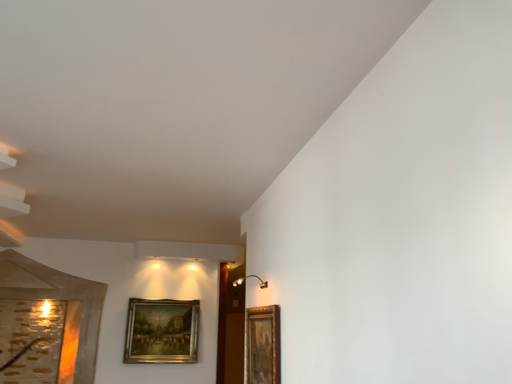
You are a GUI agent. You are given a task and a screenshot of the screen. Output one action in this format:
    pyautogui.click(x=<x>, y=<y>)
    Task: Click on the gold-framed painting at center-left, the first picture frame viewed from the back
    This screenshot has width=512, height=384.
    Given the screenshot: What is the action you would take?
    pyautogui.click(x=161, y=331)

Describe the element at coordinates (161, 331) in the screenshot. The height and width of the screenshot is (384, 512). I see `gold-framed painting at center-left, the first picture frame positioned from the bottom` at that location.

This screenshot has height=384, width=512. I want to click on gold-toned wooden picture frame at right, positioned as the 1th picture frame in top-to-bottom order, so click(263, 345).

This screenshot has height=384, width=512. Describe the element at coordinates (263, 345) in the screenshot. I see `gold-toned wooden picture frame at right, positioned as the 1th picture frame in top-to-bottom order` at that location.

The image size is (512, 384). I want to click on gold-framed painting at center-left, the first picture frame viewed from the back, so click(x=161, y=331).

In the image, is gold-toned wooden picture frame at right, the second picture frame when ordered from back to front, on the left side or the right side of gold-framed painting at center-left, acting as the 1th picture frame starting from the left?

gold-toned wooden picture frame at right, the second picture frame when ordered from back to front, is to the right of gold-framed painting at center-left, acting as the 1th picture frame starting from the left.

Is gold-toned wooden picture frame at right, positioned as the 1th picture frame in front-to-back order, in front of or behind gold-framed painting at center-left, the first picture frame positioned from the bottom, in the image?

Visually, gold-toned wooden picture frame at right, positioned as the 1th picture frame in front-to-back order, is located in front of gold-framed painting at center-left, the first picture frame positioned from the bottom.

Does point (255, 369) come behind point (192, 325)?

No.

From the image's perspective, which one is positioned higher, gold-toned wooden picture frame at right, which is counted as the 2th picture frame, starting from the left, or gold-framed painting at center-left, the first picture frame positioned from the bottom?

From the image's view, gold-toned wooden picture frame at right, which is counted as the 2th picture frame, starting from the left, is above.

From a real-world perspective, between gold-toned wooden picture frame at right, positioned as the 1th picture frame in front-to-back order, and gold-framed painting at center-left, the first picture frame positioned from the bottom, who is vertically lower?

gold-toned wooden picture frame at right, positioned as the 1th picture frame in front-to-back order.

Does gold-toned wooden picture frame at right, which is the 1th picture frame from right to left, have a greater width compared to gold-framed painting at center-left, acting as the 1th picture frame starting from the left?

No, gold-toned wooden picture frame at right, which is the 1th picture frame from right to left, is not wider than gold-framed painting at center-left, acting as the 1th picture frame starting from the left.

Which of these two, gold-toned wooden picture frame at right, positioned as the 1th picture frame in top-to-bottom order, or gold-framed painting at center-left, acting as the 1th picture frame starting from the left, stands taller?

gold-framed painting at center-left, acting as the 1th picture frame starting from the left.

Can you confirm if gold-toned wooden picture frame at right, positioned as the 1th picture frame in top-to-bottom order, is smaller than gold-framed painting at center-left, the 2th picture frame viewed from the right?

Correct, gold-toned wooden picture frame at right, positioned as the 1th picture frame in top-to-bottom order, occupies less space than gold-framed painting at center-left, the 2th picture frame viewed from the right.

Is gold-framed painting at center-left, the 2th picture frame viewed from the right, surrounded by gold-toned wooden picture frame at right, positioned as the 1th picture frame in top-to-bottom order?

Actually, gold-framed painting at center-left, the 2th picture frame viewed from the right, is outside gold-toned wooden picture frame at right, positioned as the 1th picture frame in top-to-bottom order.

Is gold-toned wooden picture frame at right, arranged as the 2th picture frame when ordered from the bottom, not near gold-framed painting at center-left, the first picture frame viewed from the back?

Yes, gold-toned wooden picture frame at right, arranged as the 2th picture frame when ordered from the bottom, is far from gold-framed painting at center-left, the first picture frame viewed from the back.

Could you tell me if gold-toned wooden picture frame at right, which is the 1th picture frame from right to left, is turned towards gold-framed painting at center-left, the first picture frame positioned from the bottom?

No.

What's the angular difference between gold-toned wooden picture frame at right, arranged as the 2th picture frame when ordered from the bottom, and gold-framed painting at center-left, the 2th picture frame viewed from the right,'s facing directions?

The angle between the facing direction of gold-toned wooden picture frame at right, arranged as the 2th picture frame when ordered from the bottom, and the facing direction of gold-framed painting at center-left, the 2th picture frame viewed from the right, is 88.3 degrees.

The height and width of the screenshot is (384, 512). In the image, there is a gold-framed painting at center-left, the 2th picture frame positioned from the top. What are the coordinates of `picture frame above it (from the image's perspective)` in the screenshot? It's located at (263, 345).

Which is more to the right, gold-framed painting at center-left, the 2th picture frame viewed from the right, or gold-toned wooden picture frame at right, positioned as the 1th picture frame in top-to-bottom order?

Positioned to the right is gold-toned wooden picture frame at right, positioned as the 1th picture frame in top-to-bottom order.

Considering the positions of objects gold-framed painting at center-left, the 2th picture frame viewed from the right, and gold-toned wooden picture frame at right, the second picture frame when ordered from back to front, in the image provided, who is in front, gold-framed painting at center-left, the 2th picture frame viewed from the right, or gold-toned wooden picture frame at right, the second picture frame when ordered from back to front,?

gold-toned wooden picture frame at right, the second picture frame when ordered from back to front.

Considering the positions of points (157, 359) and (277, 341), is point (157, 359) farther from camera compared to point (277, 341)?

Yes, it is behind point (277, 341).

From the image's perspective, is gold-framed painting at center-left, the 2th picture frame viewed from the right, under gold-toned wooden picture frame at right, arranged as the 2th picture frame when ordered from the bottom?

Yes, from the image's perspective, gold-framed painting at center-left, the 2th picture frame viewed from the right, is beneath gold-toned wooden picture frame at right, arranged as the 2th picture frame when ordered from the bottom.

From a real-world perspective, between gold-framed painting at center-left, acting as the 1th picture frame starting from the left, and gold-toned wooden picture frame at right, which is the 1th picture frame from right to left, who is vertically lower?

In real-world perspective, gold-toned wooden picture frame at right, which is the 1th picture frame from right to left, is lower.

Is gold-framed painting at center-left, the 2th picture frame viewed from the right, wider or thinner than gold-toned wooden picture frame at right, which is counted as the 2th picture frame, starting from the left?

Considering their sizes, gold-framed painting at center-left, the 2th picture frame viewed from the right, looks broader than gold-toned wooden picture frame at right, which is counted as the 2th picture frame, starting from the left.

Does gold-framed painting at center-left, placed as the 2th picture frame when sorted from front to back, have a lesser height compared to gold-toned wooden picture frame at right, positioned as the 1th picture frame in front-to-back order?

No.

Who is bigger, gold-framed painting at center-left, the 2th picture frame positioned from the top, or gold-toned wooden picture frame at right, which is the 1th picture frame from right to left?

Bigger between the two is gold-framed painting at center-left, the 2th picture frame positioned from the top.

Which is correct: gold-framed painting at center-left, the first picture frame positioned from the bottom, is inside gold-toned wooden picture frame at right, which is the 1th picture frame from right to left, or outside of it?

The correct answer is: outside.

Is there a large distance between gold-framed painting at center-left, the first picture frame positioned from the bottom, and gold-toned wooden picture frame at right, positioned as the 1th picture frame in front-to-back order?

That's right, there is a large distance between gold-framed painting at center-left, the first picture frame positioned from the bottom, and gold-toned wooden picture frame at right, positioned as the 1th picture frame in front-to-back order.

Could you tell me if gold-framed painting at center-left, the first picture frame positioned from the bottom, is facing gold-toned wooden picture frame at right, arranged as the 2th picture frame when ordered from the bottom?

Yes, gold-framed painting at center-left, the first picture frame positioned from the bottom, is facing gold-toned wooden picture frame at right, arranged as the 2th picture frame when ordered from the bottom.

How far apart are gold-framed painting at center-left, placed as the 2th picture frame when sorted from front to back, and gold-toned wooden picture frame at right, positioned as the 1th picture frame in front-to-back order?

A distance of 6.97 feet exists between gold-framed painting at center-left, placed as the 2th picture frame when sorted from front to back, and gold-toned wooden picture frame at right, positioned as the 1th picture frame in front-to-back order.

Where is `picture frame beneath the gold-framed painting at center-left, the 2th picture frame viewed from the right (from a real-world perspective)`? picture frame beneath the gold-framed painting at center-left, the 2th picture frame viewed from the right (from a real-world perspective) is located at coordinates (263, 345).

Image resolution: width=512 pixels, height=384 pixels. Find the location of `picture frame located above the gold-framed painting at center-left, the 2th picture frame viewed from the right (from the image's perspective)`. picture frame located above the gold-framed painting at center-left, the 2th picture frame viewed from the right (from the image's perspective) is located at coordinates (263, 345).

Where is `picture frame lying in front of the gold-framed painting at center-left, the 2th picture frame viewed from the right`? picture frame lying in front of the gold-framed painting at center-left, the 2th picture frame viewed from the right is located at coordinates (263, 345).